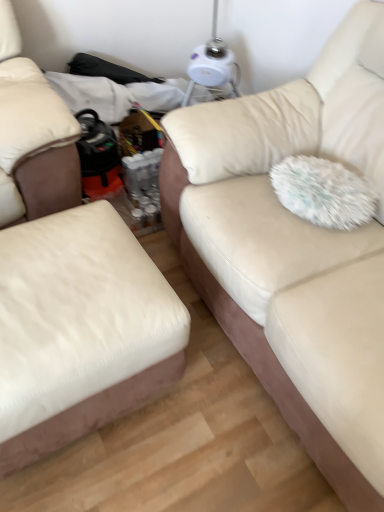
Question: From the image's perspective, relative to white plastic table lamp at upper center, is white fluffy pillow at right above or below?

Choices:
 (A) below
 (B) above

Answer: (A)

Question: Looking at their shapes, would you say white fluffy pillow at right is wider or thinner than white plastic table lamp at upper center?

Choices:
 (A) thin
 (B) wide

Answer: (B)

Question: Which object is positioned farthest from the beige fabric couch at center, marked as the second studio couch in a left-to-right arrangement?

Choices:
 (A) white leather ottoman at left, marked as the second studio couch in a right-to-left arrangement
 (B) white plastic table lamp at upper center
 (C) white fluffy pillow at right

Answer: (B)

Question: Estimate the real-world distances between objects in this image. Which object is closer to the white leather ottoman at left, acting as the first studio couch starting from the left?

Choices:
 (A) white fluffy pillow at right
 (B) white plastic table lamp at upper center
 (C) beige fabric couch at center, placed as the 1th studio couch when sorted from right to left

Answer: (C)